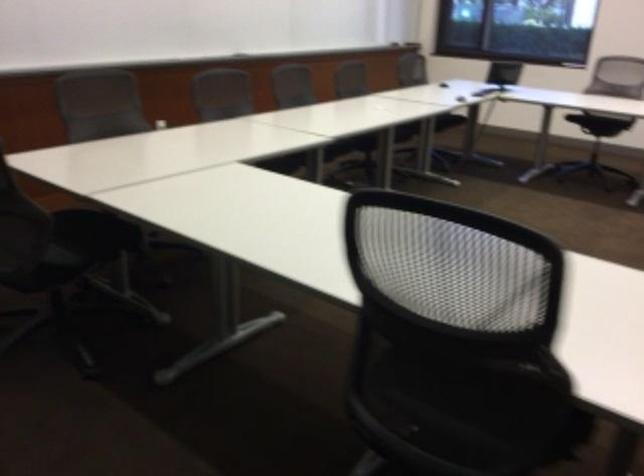
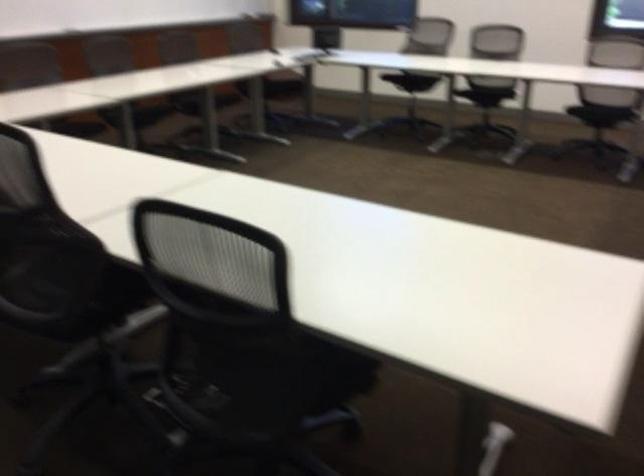
Locate, in the second image, the point that corresponds to pixel 471 124 in the first image.

(277, 85)